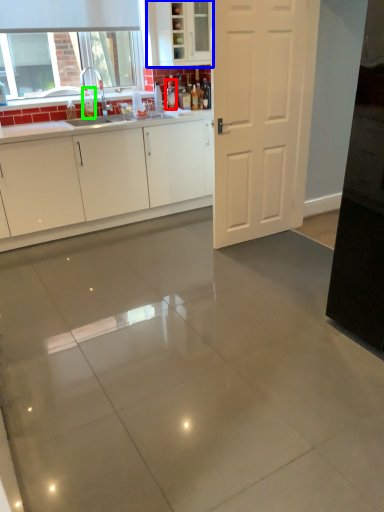
Question: Estimate the real-world distances between objects in this image. Which object is closer to bottle (highlighted by a red box), cabinetry (highlighted by a blue box) or bottle (highlighted by a green box)?

Choices:
 (A) cabinetry
 (B) bottle

Answer: (A)